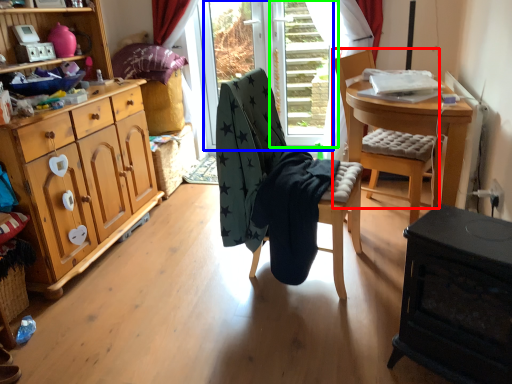
Question: Which object is positioned closest to chair (highlighted by a red box)? Select from glass door (highlighted by a blue box) and screen door (highlighted by a green box).

Choices:
 (A) glass door
 (B) screen door

Answer: (B)